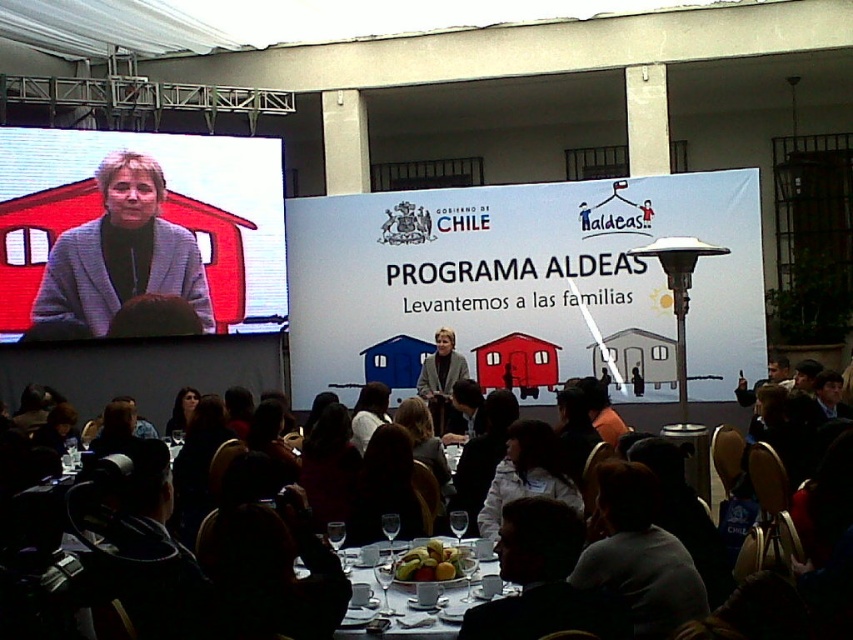
You are planning to place a small decorative item on the stage where the smooth yellow fruit at center is currently located. The item requires a space that is at least as large as the matte gray blazer at upper left. Is the current space sufficient?

The matte gray blazer at upper left is bigger than the smooth yellow fruit at center. Since the required space must be at least as large as the matte gray blazer at upper left, the current space where the smooth yellow fruit at center is located may not be sufficient because it is smaller than the blazer.

You are a photographer at the event and want to capture a photo of the smooth yellow fruit at center without the matte gray blazer at upper left blocking the view. Is this possible?

The matte gray blazer at upper left is further to the viewer than the smooth yellow fruit at center, so the blazer is closer to the camera. This means the blazer would block the view of the fruit. Move the camera position to avoid the blazer.